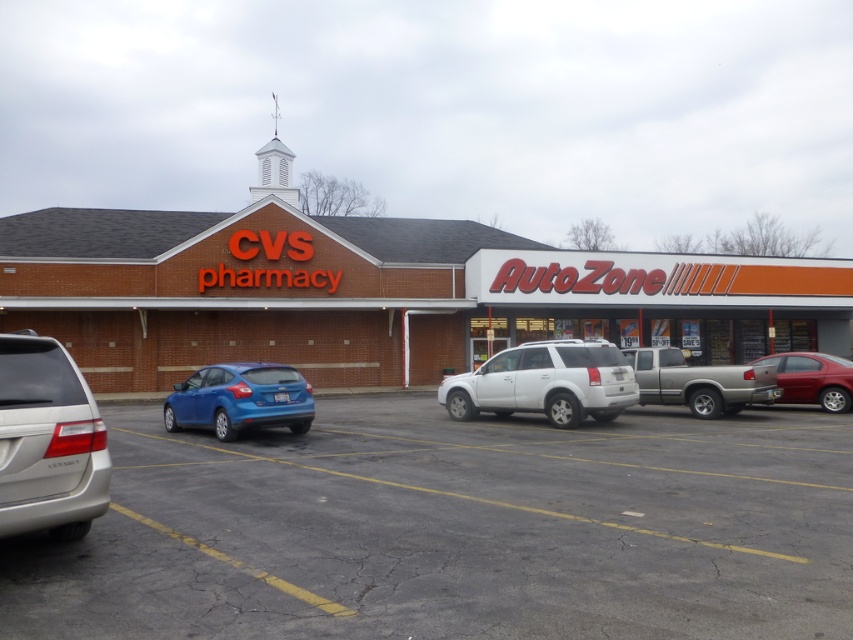
Question: Does white matte suv at center appear over metallic red sedan at right?

Choices:
 (A) yes
 (B) no

Answer: (B)

Question: Does white matte suv at center appear on the right side of silver metallic truck at center-right?

Choices:
 (A) yes
 (B) no

Answer: (B)

Question: Which object is farther from the camera taking this photo?

Choices:
 (A) metallic red sedan at right
 (B) satin silver minivan at lower left

Answer: (A)

Question: Which point is closer to the camera?

Choices:
 (A) (258, 404)
 (B) (645, 570)

Answer: (B)

Question: Considering the real-world distances, which object is closest to the matte blue hatchback at lower left?

Choices:
 (A) white matte suv at center
 (B) satin silver minivan at lower left

Answer: (A)

Question: Does smooth asphalt parking lot at lower left lie behind silver metallic truck at center-right?

Choices:
 (A) yes
 (B) no

Answer: (B)